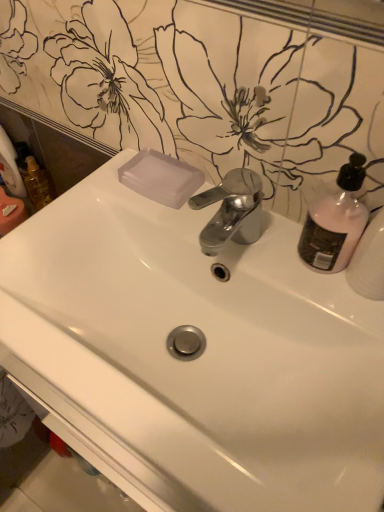
Question: Is white matte toilet paper at left at the right side of white glossy sink at center?

Choices:
 (A) yes
 (B) no

Answer: (B)

Question: From the image's perspective, is white matte toilet paper at left located above white glossy sink at center?

Choices:
 (A) yes
 (B) no

Answer: (A)

Question: Would you say white glossy sink at center is part of white matte toilet paper at left's contents?

Choices:
 (A) no
 (B) yes

Answer: (A)

Question: Is white matte toilet paper at left bigger than white glossy sink at center?

Choices:
 (A) yes
 (B) no

Answer: (B)

Question: Can we say white matte toilet paper at left lies outside white glossy sink at center?

Choices:
 (A) no
 (B) yes

Answer: (B)

Question: Can you confirm if white matte toilet paper at left is shorter than white glossy sink at center?

Choices:
 (A) yes
 (B) no

Answer: (A)

Question: Is translucent plastic mouthwash at left completely or partially inside pink matte bottle at upper right?

Choices:
 (A) no
 (B) yes

Answer: (A)

Question: Is pink matte bottle at upper right aimed at translucent plastic mouthwash at left?

Choices:
 (A) yes
 (B) no

Answer: (B)

Question: Can you confirm if pink matte bottle at upper right is thinner than translucent plastic mouthwash at left?

Choices:
 (A) yes
 (B) no

Answer: (B)

Question: Are pink matte bottle at upper right and translucent plastic mouthwash at left making contact?

Choices:
 (A) no
 (B) yes

Answer: (A)

Question: Does pink matte bottle at upper right have a smaller size compared to translucent plastic mouthwash at left?

Choices:
 (A) yes
 (B) no

Answer: (B)

Question: Is translucent plastic mouthwash at left at the back of pink matte bottle at upper right?

Choices:
 (A) yes
 (B) no

Answer: (B)

Question: Can you confirm if translucent plastic soap at upper center is positioned to the right of pink matte bottle at upper right?

Choices:
 (A) no
 (B) yes

Answer: (A)